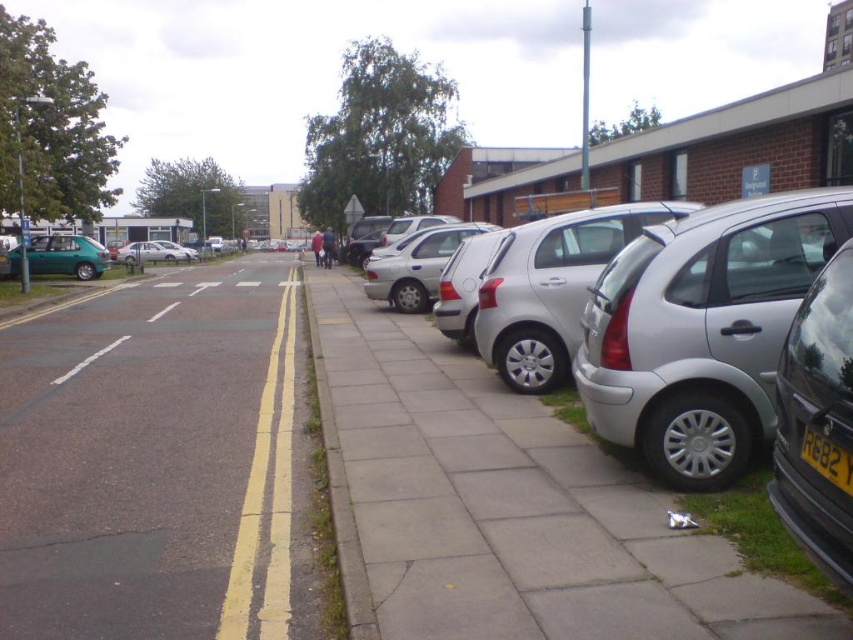
Question: Which of the following is the farthest from the observer?

Choices:
 (A) (310, 348)
 (B) (171, 252)
 (C) (606, 268)

Answer: (B)

Question: Can you confirm if silver metallic hatchback at center is smaller than yellow matte license plate at center-right?

Choices:
 (A) no
 (B) yes

Answer: (A)

Question: Which of these objects is positioned farthest from the yellow asphalt road at center?

Choices:
 (A) silver metallic hatchback at right
 (B) metallic silver car at right
 (C) yellow matte license plate at center-right

Answer: (C)

Question: Can you confirm if metallic silver car at right is positioned to the right of silver metallic sedan at center?

Choices:
 (A) no
 (B) yes

Answer: (B)

Question: Can you confirm if gray concrete curb at lower left is positioned to the right of silver metallic hatchback at center?

Choices:
 (A) yes
 (B) no

Answer: (B)

Question: Which of the following is the farthest from the observer?

Choices:
 (A) (721, 592)
 (B) (819, 468)

Answer: (A)